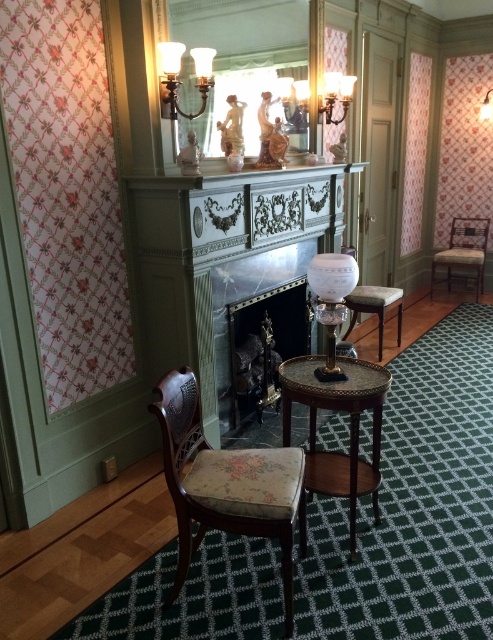
You are a guest standing in the room and want to place a tall plant on the rustic wood side table at center. However, you notice the matte brass chandelier at upper center above it. Will the plant potentially hit the chandelier when placed there?

The rustic wood side table at center is much taller than the matte brass chandelier at upper center, so placing the tall plant on the rustic wood side table at center would not cause it to hit the chandelier.

You are standing in the room and want to move from the floral fabric armchair at lower left to the matte brass chandelier at upper center. Which direction should you move?

You should move to the left because the floral fabric armchair at lower left is to the right of the matte brass chandelier at upper center.